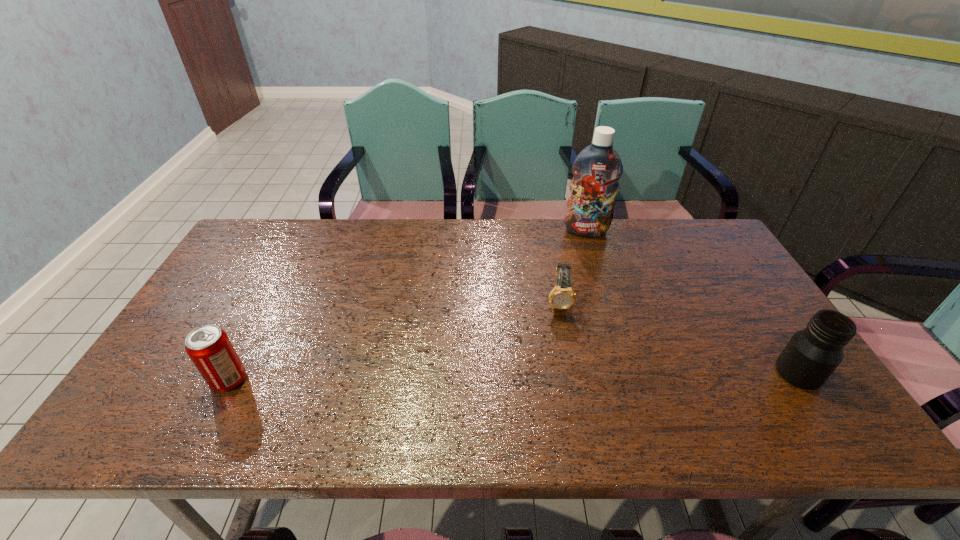
You are a GUI agent. You are given a task and a screenshot of the screen. Output one action in this format:
    pyautogui.click(x=<x>, y=<y>)
    Task: Click on the vacant space on the desktop that is between the second shortest object and the jar and is positioned on the face of the third object from right to left
    Image resolution: width=960 pixels, height=540 pixels.
    Given the screenshot: What is the action you would take?
    pyautogui.click(x=562, y=376)

In order to click on free space on the desktop that is between the soda can and the jar and is positioned on the front label of the tallest object in this screenshot , I will do `click(598, 375)`.